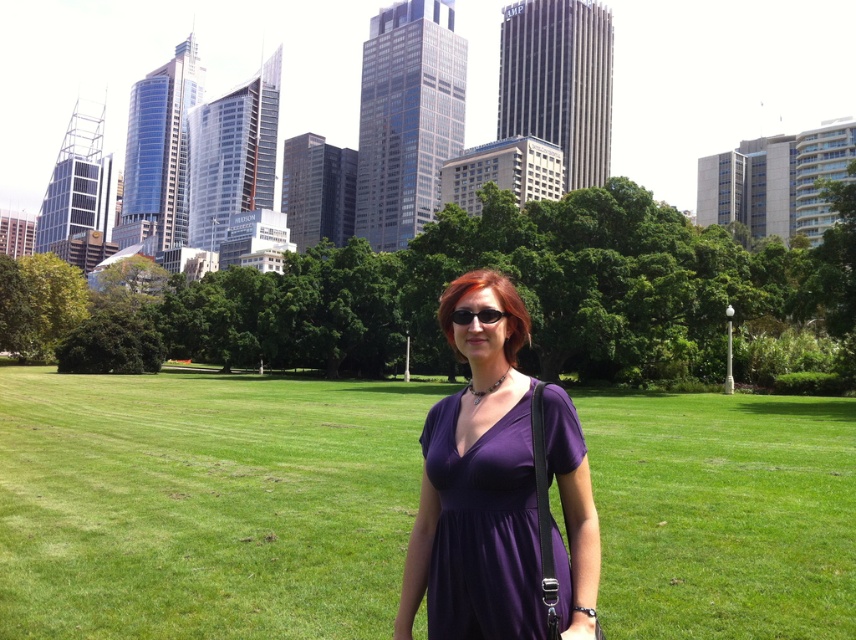
Question: Among these objects, which one is nearest to the camera?

Choices:
 (A) black plastic sunglasses at center
 (B) purple matte dress at center
 (C) purple fabric dress at center

Answer: (B)

Question: Can you confirm if purple fabric dress at center is positioned above purple matte dress at center?

Choices:
 (A) yes
 (B) no

Answer: (B)

Question: Estimate the real-world distances between objects in this image. Which object is farther from the black plastic sunglasses at center?

Choices:
 (A) purple fabric dress at center
 (B) purple matte dress at center

Answer: (A)

Question: Among these points, which one is farthest from the camera?

Choices:
 (A) (381, 536)
 (B) (467, 531)

Answer: (A)

Question: Is purple fabric dress at center to the left of purple matte dress at center from the viewer's perspective?

Choices:
 (A) no
 (B) yes

Answer: (B)

Question: Where is purple matte dress at center located in relation to black plastic sunglasses at center in the image?

Choices:
 (A) above
 (B) below

Answer: (B)